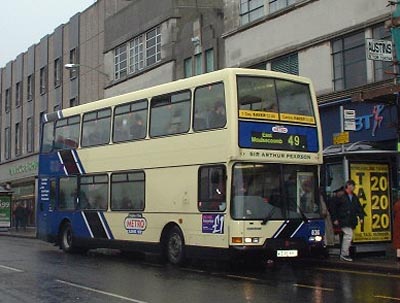
Locate an element on the screen. shoe is located at coordinates (346, 260).